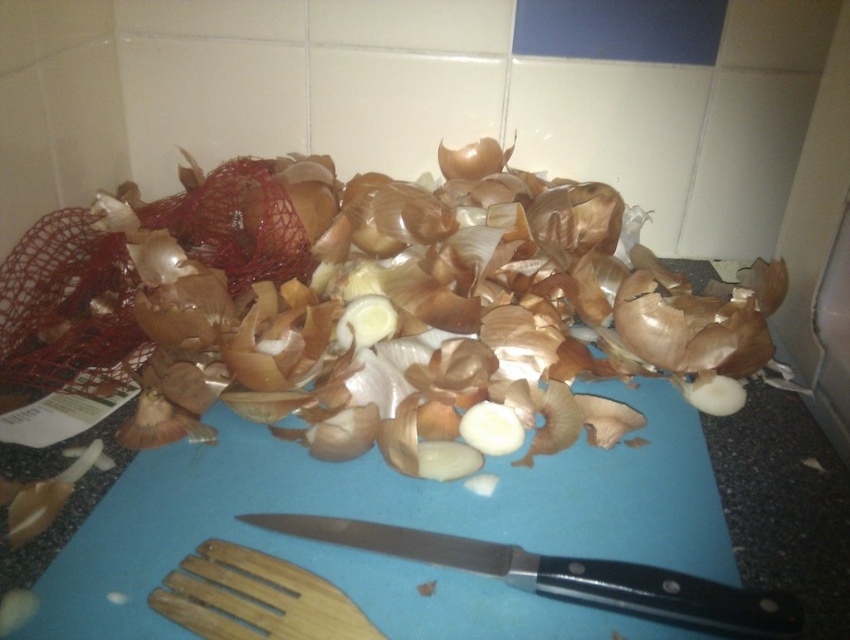
Who is more forward, (588, 474) or (248, 609)?

Positioned in front is point (248, 609).

Is blue plastic cutting board at center bigger than wooden fork at lower left?

Yes, blue plastic cutting board at center is bigger than wooden fork at lower left.

Does point (312, 570) lie in front of point (340, 596)?

That is False.

You are a GUI agent. You are given a task and a screenshot of the screen. Output one action in this format:
    pyautogui.click(x=<x>, y=<y>)
    Task: Click on the blue plastic cutting board at center
    The width and height of the screenshot is (850, 640).
    Given the screenshot: What is the action you would take?
    pyautogui.click(x=398, y=524)

Is black plastic knife at center positioned before wooden fork at lower left?

That is False.

Is point (547, 572) positioned in front of point (333, 614)?

No, (547, 572) is further to viewer.

Locate an element on the screen. black plastic knife at center is located at coordinates (565, 577).

Can you confirm if blue plastic cutting board at center is taller than brown matte onion at center?

Indeed, blue plastic cutting board at center has a greater height compared to brown matte onion at center.

Does blue plastic cutting board at center appear on the right side of brown matte onion at center?

No, blue plastic cutting board at center is not to the right of brown matte onion at center.

The height and width of the screenshot is (640, 850). Find the location of `blue plastic cutting board at center`. blue plastic cutting board at center is located at coordinates (398, 524).